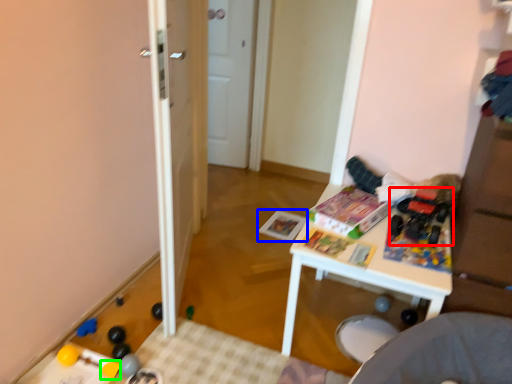
Question: Which object is the closest to the toy (highlighted by a red box)? Choose among these: magazine (highlighted by a blue box) or toy (highlighted by a green box).

Choices:
 (A) magazine
 (B) toy

Answer: (A)